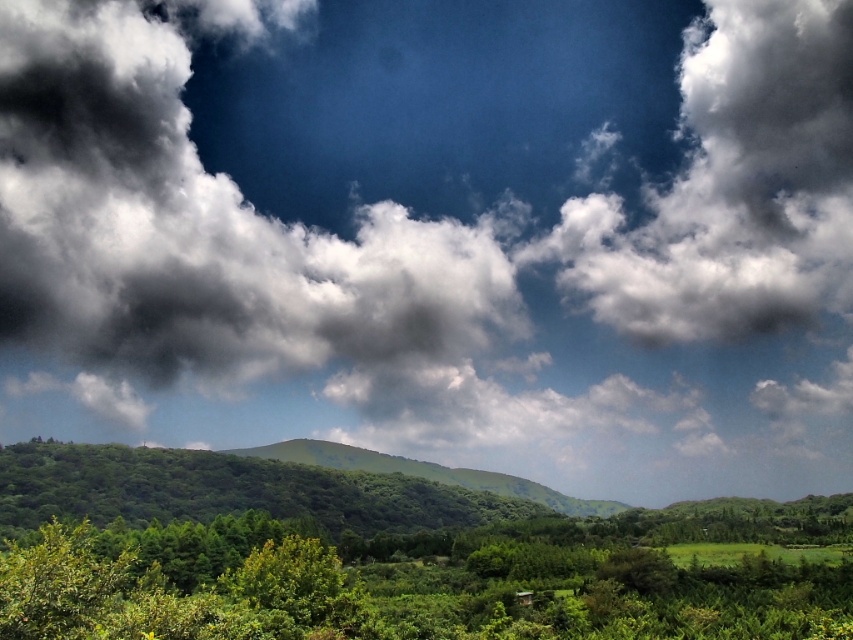
You are standing at the point marked by point (x=405, y=595) in the image. Looking around, you see dense vegetation in the foreground and rolling hills in the midground. What is the closest object to you?

The closest object to you is the green leafy tree at lower center marked by point (x=405, y=595).

You are standing in the vibrant landscape described. There is a white fluffy cloud at upper right located at point (734, 188). If you want to look at the cloud, where should you direct your gaze?

You should direct your gaze to the upper right, where the white fluffy cloud at upper right is located at point (734, 188).